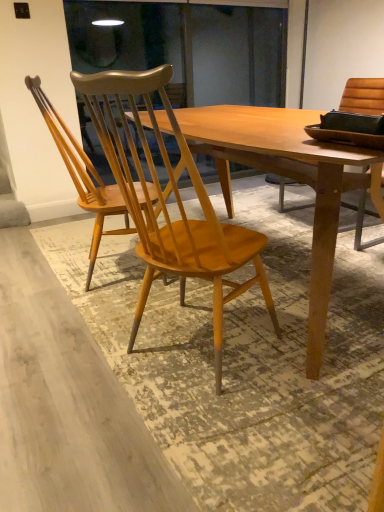
Question: From a real-world perspective, is light brown wood chair at center, the 2th chair when ordered from left to right, positioned over light brown wood chair at center, which ranks as the first chair in left-to-right order, based on gravity?

Choices:
 (A) no
 (B) yes

Answer: (A)

Question: From the image's perspective, would you say light brown wood chair at center, the 2th chair when ordered from left to right, is shown under light brown wood chair at center, which ranks as the first chair in left-to-right order?

Choices:
 (A) yes
 (B) no

Answer: (A)

Question: Is light brown wood chair at center, the 2th chair when ordered from left to right, to the right of light brown wood chair at center, which is counted as the second chair, starting from the right, from the viewer's perspective?

Choices:
 (A) no
 (B) yes

Answer: (B)

Question: Is light brown wood chair at center, the 2th chair when ordered from left to right, to the left of light brown wood chair at center, which ranks as the first chair in left-to-right order, from the viewer's perspective?

Choices:
 (A) no
 (B) yes

Answer: (A)

Question: Would you consider light brown wood chair at center, the 1th chair viewed from the right, to be distant from light brown wood chair at center, which is counted as the second chair, starting from the right?

Choices:
 (A) yes
 (B) no

Answer: (B)

Question: From the image's perspective, would you say light brown wood chair at center, the 1th chair viewed from the right, is positioned over light brown wood chair at center, which is counted as the second chair, starting from the right?

Choices:
 (A) yes
 (B) no

Answer: (B)

Question: Is light brown wood chair at center, which is counted as the second chair, starting from the right, oriented away from light brown wood chair at center, the 2th chair when ordered from left to right?

Choices:
 (A) yes
 (B) no

Answer: (B)

Question: Can you confirm if light brown wood chair at center, which is counted as the second chair, starting from the right, is smaller than light brown wood chair at center, the 2th chair when ordered from left to right?

Choices:
 (A) yes
 (B) no

Answer: (A)

Question: Is light brown wood chair at center, which ranks as the first chair in left-to-right order, at the right side of light brown wood chair at center, the 2th chair when ordered from left to right?

Choices:
 (A) no
 (B) yes

Answer: (A)

Question: Are light brown wood chair at center, which is counted as the second chair, starting from the right, and light brown wood chair at center, the 2th chair when ordered from left to right, located far from each other?

Choices:
 (A) yes
 (B) no

Answer: (B)

Question: Does light brown wood chair at center, which is counted as the second chair, starting from the right, turn towards light brown wood chair at center, the 1th chair viewed from the right?

Choices:
 (A) yes
 (B) no

Answer: (B)

Question: Is light brown wood chair at center, which ranks as the first chair in left-to-right order, not within light brown wood chair at center, the 1th chair viewed from the right?

Choices:
 (A) yes
 (B) no

Answer: (A)

Question: Does point (94, 167) appear closer or farther from the camera than point (162, 200)?

Choices:
 (A) farther
 (B) closer

Answer: (A)